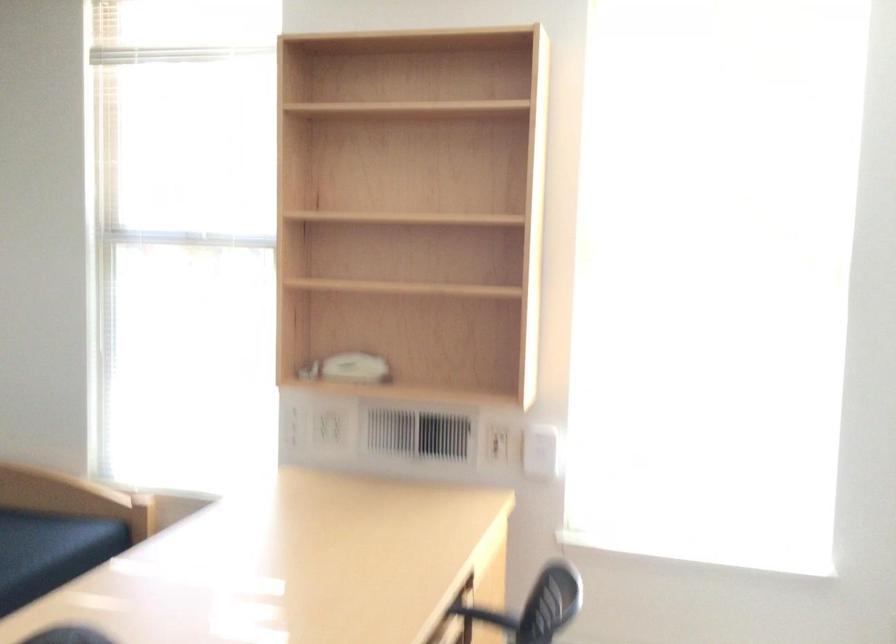
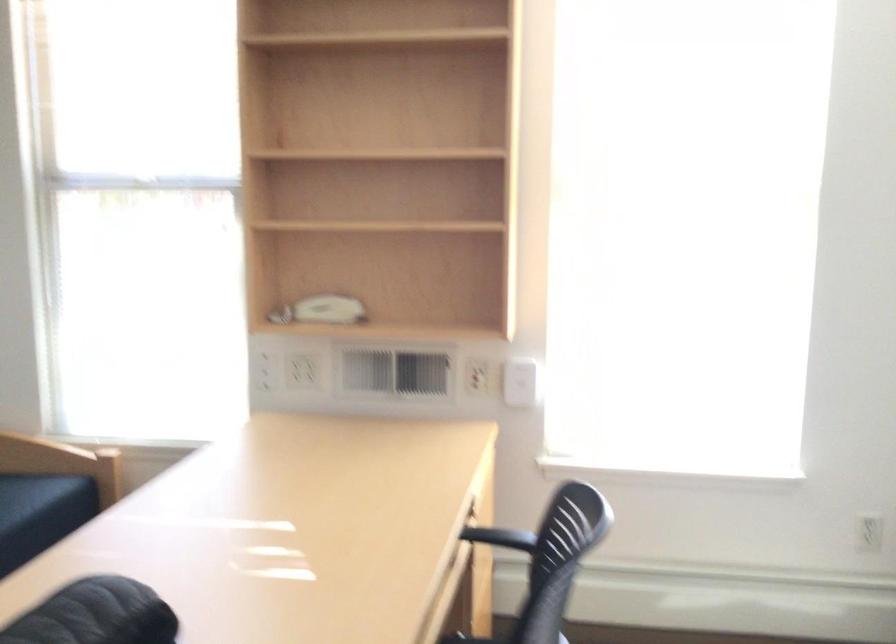
Locate, in the second image, the point that corresponds to point 329,428 in the first image.

(303, 371)